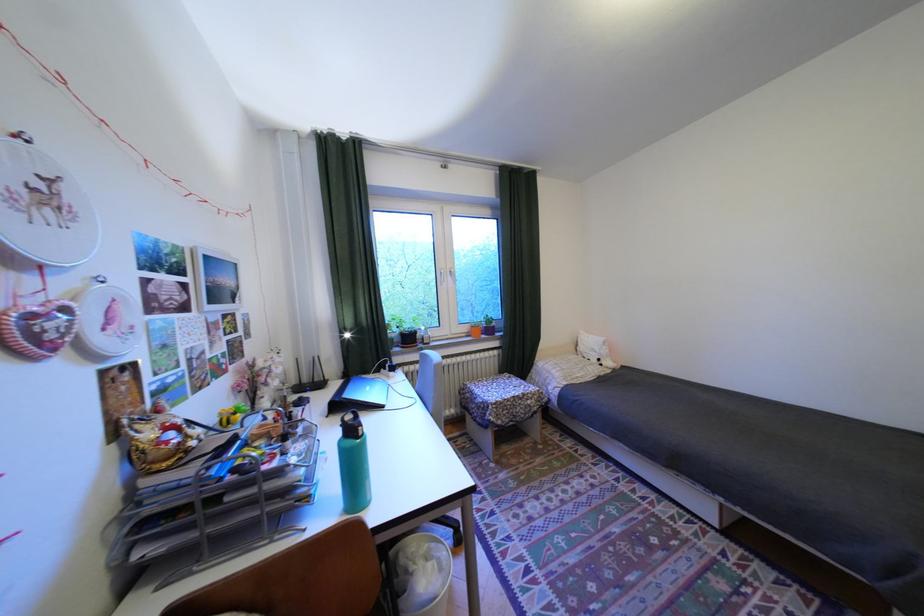
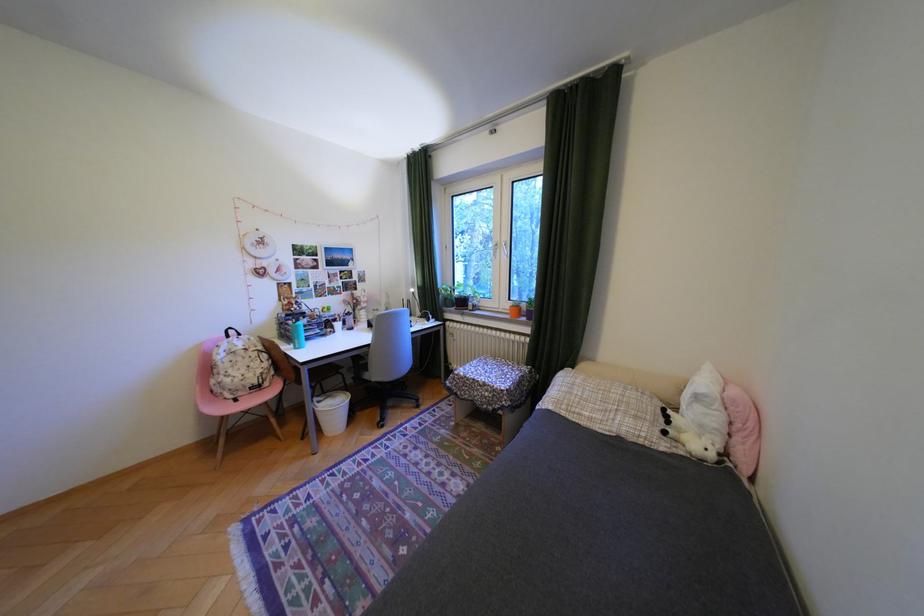
Locate, in the second image, the point that corresponds to [512,422] in the first image.

(470, 392)